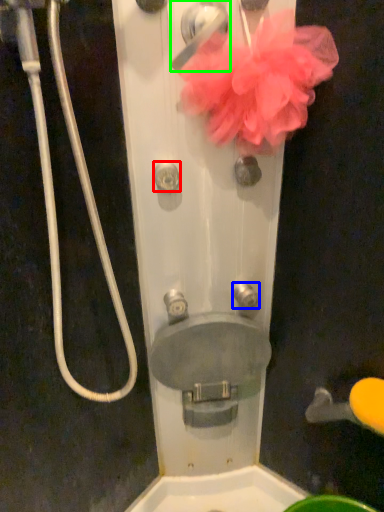
Question: Estimate the real-world distances between objects in this image. Which object is closer to knob (highlighted by a red box), knob (highlighted by a blue box) or door handle (highlighted by a green box)?

Choices:
 (A) knob
 (B) door handle

Answer: (B)